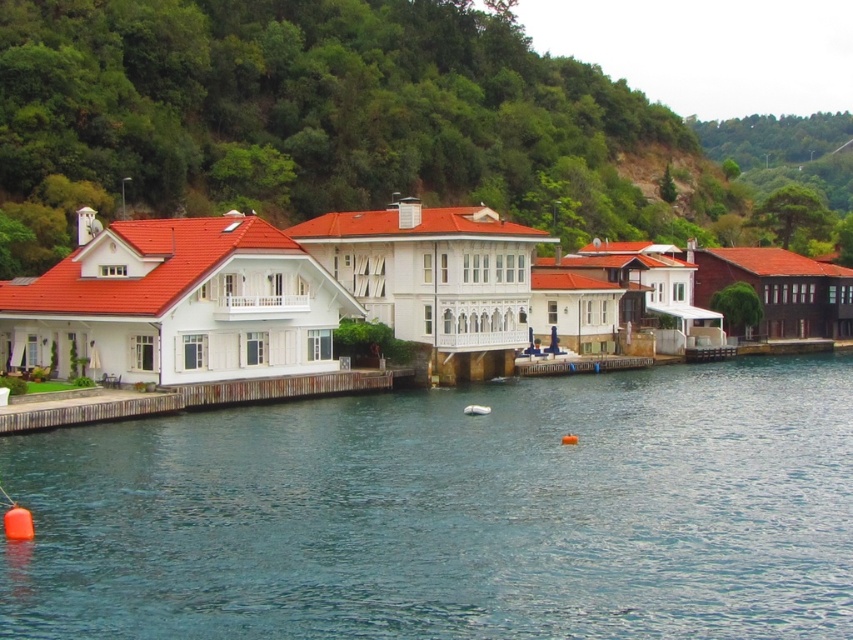
Between blue water at center and wooden dock at lower left, which one has less height?

Standing shorter between the two is wooden dock at lower left.

Is blue water at center positioned in front of wooden dock at lower left?

Yes, blue water at center is in front of wooden dock at lower left.

Is point (461, 470) farther from camera compared to point (225, 403)?

No, it is not.

Locate an element on the screen. The image size is (853, 640). blue water at center is located at coordinates (451, 513).